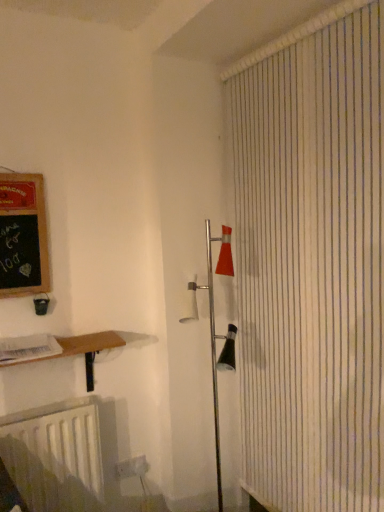
Question: From a real-world perspective, is white striped shower curtain at right positioned under black chalkboard at left based on gravity?

Choices:
 (A) yes
 (B) no

Answer: (A)

Question: Does white striped shower curtain at right turn towards black chalkboard at left?

Choices:
 (A) no
 (B) yes

Answer: (B)

Question: Is the depth of white striped shower curtain at right less than that of black chalkboard at left?

Choices:
 (A) no
 (B) yes

Answer: (B)

Question: Is white striped shower curtain at right located outside black chalkboard at left?

Choices:
 (A) yes
 (B) no

Answer: (A)

Question: Is white striped shower curtain at right at the right side of black chalkboard at left?

Choices:
 (A) no
 (B) yes

Answer: (B)

Question: Do you think wooden at lower left is within white matte radiator at lower left, or outside of it?

Choices:
 (A) inside
 (B) outside

Answer: (B)

Question: In terms of height, does wooden at lower left look taller or shorter compared to white matte radiator at lower left?

Choices:
 (A) short
 (B) tall

Answer: (A)

Question: From a real-world perspective, is wooden at lower left above or below white matte radiator at lower left?

Choices:
 (A) above
 (B) below

Answer: (A)

Question: In terms of size, does wooden at lower left appear bigger or smaller than white matte radiator at lower left?

Choices:
 (A) big
 (B) small

Answer: (A)

Question: Considering the positions of white plastic electric outlet at lower center and black chalkboard at left in the image, is white plastic electric outlet at lower center wider or thinner than black chalkboard at left?

Choices:
 (A) wide
 (B) thin

Answer: (B)

Question: From a real-world perspective, is white plastic electric outlet at lower center positioned above or below black chalkboard at left?

Choices:
 (A) below
 (B) above

Answer: (A)

Question: From the image's perspective, is white plastic electric outlet at lower center above or below black chalkboard at left?

Choices:
 (A) above
 (B) below

Answer: (B)

Question: Considering the relative positions of white plastic electric outlet at lower center and black chalkboard at left in the image provided, is white plastic electric outlet at lower center to the left or to the right of black chalkboard at left?

Choices:
 (A) right
 (B) left

Answer: (A)

Question: Considering the relative positions of white striped shower curtain at right and white matte radiator at lower left in the image provided, is white striped shower curtain at right to the left or to the right of white matte radiator at lower left?

Choices:
 (A) left
 (B) right

Answer: (B)

Question: In terms of height, does white striped shower curtain at right look taller or shorter compared to white matte radiator at lower left?

Choices:
 (A) tall
 (B) short

Answer: (A)